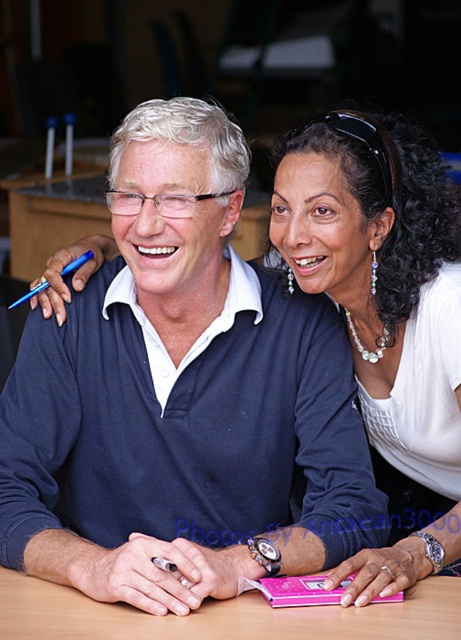
Question: Is pearl necklace at center to the left of wooden table at center from the viewer's perspective?

Choices:
 (A) no
 (B) yes

Answer: (A)

Question: Can you confirm if matte blue sweater at center is thinner than wooden table at center?

Choices:
 (A) no
 (B) yes

Answer: (B)

Question: Which object is the closest to the pearl necklace at center?

Choices:
 (A) matte blue sweater at center
 (B) wooden table at center

Answer: (A)

Question: Does matte blue sweater at center appear on the left side of pearl necklace at center?

Choices:
 (A) yes
 (B) no

Answer: (A)

Question: Which point is closer to the camera?

Choices:
 (A) pearl necklace at center
 (B) wooden table at center
 (C) matte blue sweater at center

Answer: (B)

Question: Which object is the closest to the matte blue sweater at center?

Choices:
 (A) pearl necklace at center
 (B) wooden table at center

Answer: (A)